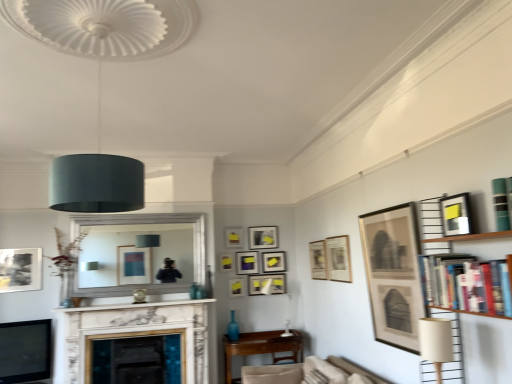
Question: Is matte beige lampshade at lower right, which is counted as the 1th lamp, starting from the bottom, looking in the opposite direction of matte yellow picture frame at center, the seventh picture frame from the front?

Choices:
 (A) no
 (B) yes

Answer: (A)

Question: Does matte beige lampshade at lower right, which is the 2th lamp from left to right, have a lesser width compared to matte yellow picture frame at center, the 6th picture frame from the back?

Choices:
 (A) no
 (B) yes

Answer: (A)

Question: Can you confirm if matte beige lampshade at lower right, acting as the first lamp starting from the right, is wider than matte yellow picture frame at center, the seventh picture frame from the front?

Choices:
 (A) no
 (B) yes

Answer: (B)

Question: From a real-world perspective, does matte beige lampshade at lower right, which is counted as the 1th lamp, starting from the bottom, stand above matte yellow picture frame at center, which ranks as the second picture frame in left-to-right order?

Choices:
 (A) no
 (B) yes

Answer: (A)

Question: Is the position of matte beige lampshade at lower right, which is the 2th lamp from left to right, less distant than that of matte yellow picture frame at center, which appears as the 11th picture frame when viewed from the right?

Choices:
 (A) no
 (B) yes

Answer: (B)

Question: From a real-world perspective, is matte black picture frame at upper right, the 12th picture frame when ordered from back to front, physically located above or below matte black picture frame at left, the eighth picture frame in the back-to-front sequence?

Choices:
 (A) below
 (B) above

Answer: (B)

Question: In the image, is matte black picture frame at upper right, acting as the first picture frame starting from the right, on the left side or the right side of matte black picture frame at left, the fifth picture frame viewed from the front?

Choices:
 (A) left
 (B) right

Answer: (B)

Question: Considering the positions of point (457, 218) and point (3, 271), is point (457, 218) closer or farther from the camera than point (3, 271)?

Choices:
 (A) closer
 (B) farther

Answer: (A)

Question: Is matte black picture frame at upper right, positioned as the 12th picture frame in left-to-right order, bigger or smaller than matte black picture frame at left, placed as the 12th picture frame when sorted from right to left?

Choices:
 (A) small
 (B) big

Answer: (A)

Question: From the image's perspective, is matte black picture frame at upper center, which appears as the 6th picture frame when viewed from the left, located above or below matte yellow picture frame at upper center, which is the 6th picture frame from front to back?

Choices:
 (A) below
 (B) above

Answer: (B)

Question: From a real-world perspective, is matte black picture frame at upper center, the first picture frame when ordered from back to front, above or below matte yellow picture frame at upper center, the ninth picture frame positioned from the right?

Choices:
 (A) above
 (B) below

Answer: (A)

Question: Considering the positions of matte black picture frame at upper center, the 7th picture frame viewed from the right, and matte yellow picture frame at upper center, acting as the 7th picture frame starting from the back, in the image, is matte black picture frame at upper center, the 7th picture frame viewed from the right, bigger or smaller than matte yellow picture frame at upper center, acting as the 7th picture frame starting from the back,?

Choices:
 (A) small
 (B) big

Answer: (B)

Question: Would you say matte black picture frame at upper center, which is the twelfth picture frame from front to back, is to the left or to the right of matte yellow picture frame at upper center, acting as the 7th picture frame starting from the back, in the picture?

Choices:
 (A) right
 (B) left

Answer: (A)

Question: Considering the relative positions of matte yellow picture frame at upper center, which is the 6th picture frame from front to back, and matte black picture frame at center, positioned as the 4th picture frame in back-to-front order, in the image provided, is matte yellow picture frame at upper center, which is the 6th picture frame from front to back, to the left or to the right of matte black picture frame at center, positioned as the 4th picture frame in back-to-front order,?

Choices:
 (A) right
 (B) left

Answer: (B)

Question: Is point (243, 291) positioned closer to the camera than point (254, 269)?

Choices:
 (A) farther
 (B) closer

Answer: (B)